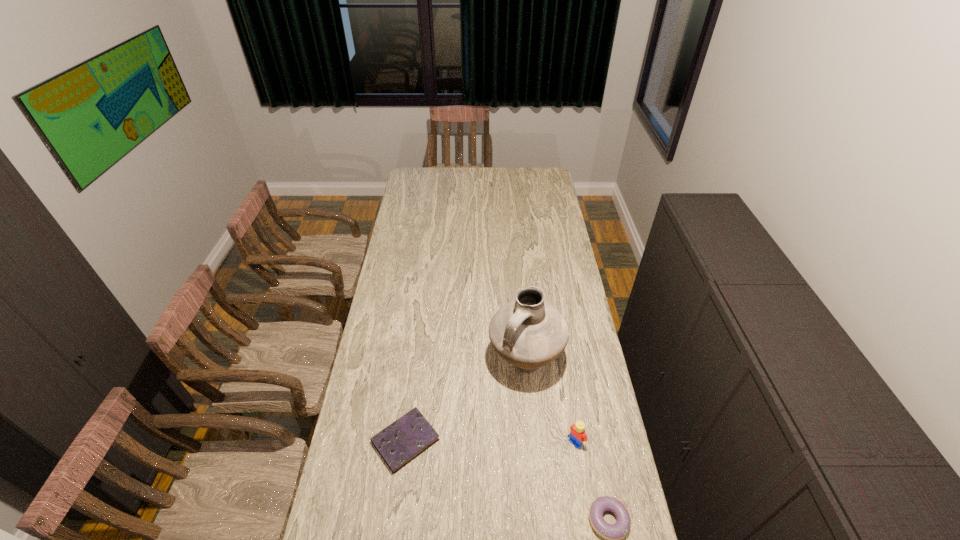
Where is `free space between the shortest object and the second tallest object`? The height and width of the screenshot is (540, 960). free space between the shortest object and the second tallest object is located at coordinates (491, 441).

Identify the location of free space between the pitcher and the leftmost object. (466, 401).

Locate an element on the screen. free space that is in between the shortest object and the third shortest object is located at coordinates (491, 441).

Identify the location of unoccupied position between the tallest object and the leftmost object. The width and height of the screenshot is (960, 540). (466, 401).

Find the location of `the second closest object relative to the Lego`. the second closest object relative to the Lego is located at coordinates (528, 332).

Locate which object is the third closest to the nearest object. Please provide its 2D coordinates. Your answer should be formatted as a tuple, i.e. [(x, y)], where the tuple contains the x and y coordinates of a point satisfying the conditions above.

[(402, 441)]